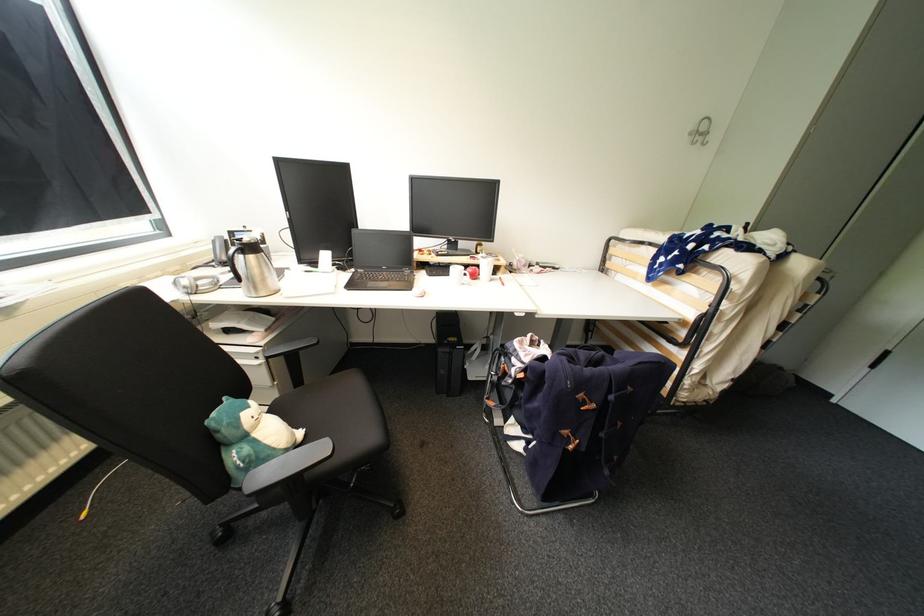
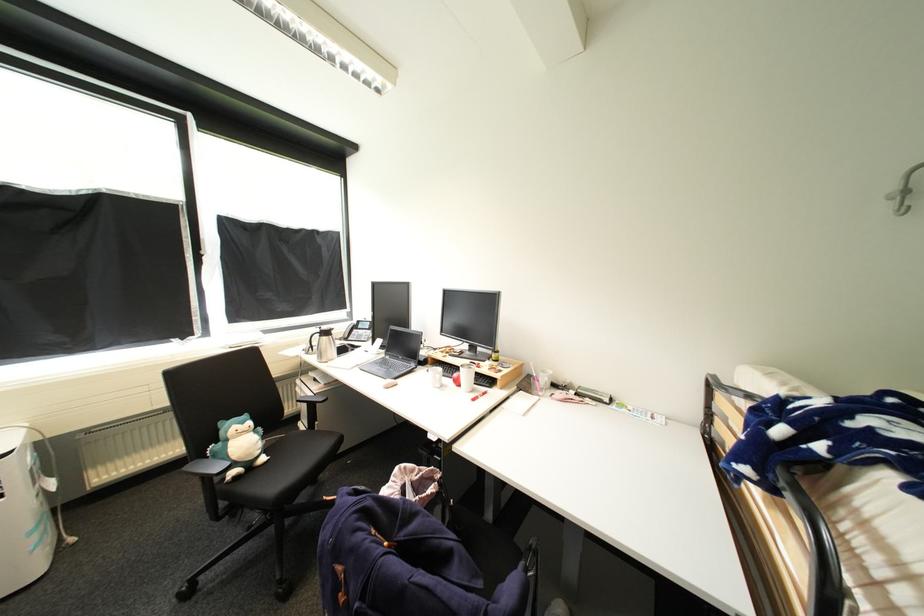
Find the pixel in the second image that matches (696,136) in the first image.

(900, 199)